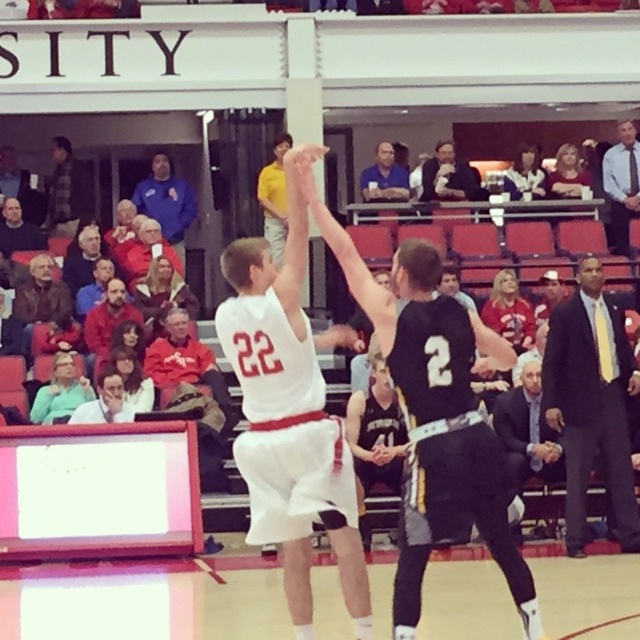
Does white matte jersey at center have a greater height compared to black jersey at center?

Correct, white matte jersey at center is much taller as black jersey at center.

Where is `white matte jersey at center`? The image size is (640, 640). white matte jersey at center is located at coordinates (291, 413).

Is point (332, 445) positioned before point (477, 477)?

That is False.

Locate an element on the screen. This screenshot has width=640, height=640. white matte jersey at center is located at coordinates (291, 413).

Can you confirm if black jersey at center is positioned above blue shirt at upper center?

Incorrect, black jersey at center is not positioned above blue shirt at upper center.

Is black jersey at center shorter than blue shirt at upper center?

In fact, black jersey at center may be taller than blue shirt at upper center.

The image size is (640, 640). What do you see at coordinates (435, 381) in the screenshot?
I see `black jersey at center` at bounding box center [435, 381].

The width and height of the screenshot is (640, 640). Identify the location of black jersey at center. (435, 381).

Is point (516, 596) positioned in front of point (620, 163)?

Yes.

Who is taller, black jersey at center or light blue shirt at upper right?

black jersey at center

This screenshot has height=640, width=640. What do you see at coordinates (435, 381) in the screenshot?
I see `black jersey at center` at bounding box center [435, 381].

You are a GUI agent. You are given a task and a screenshot of the screen. Output one action in this format:
    pyautogui.click(x=<x>, y=<y>)
    Task: Click on the black jersey at center
    
    Given the screenshot: What is the action you would take?
    click(435, 381)